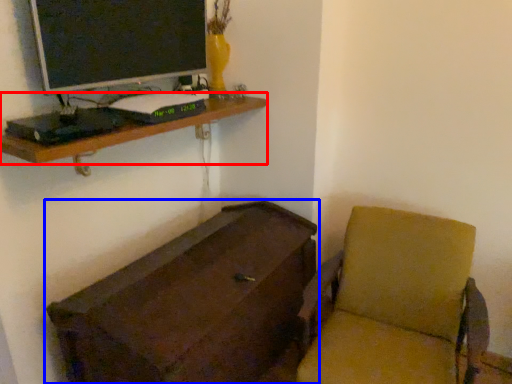
Question: Which object is closer to the camera taking this photo, shelf (highlighted by a red box) or furniture (highlighted by a blue box)?

Choices:
 (A) shelf
 (B) furniture

Answer: (B)